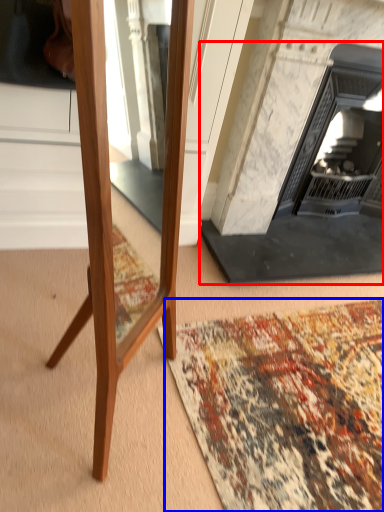
Question: Which object appears closest to the camera in this image, fireplace (highlighted by a red box) or mat (highlighted by a blue box)?

Choices:
 (A) fireplace
 (B) mat

Answer: (B)